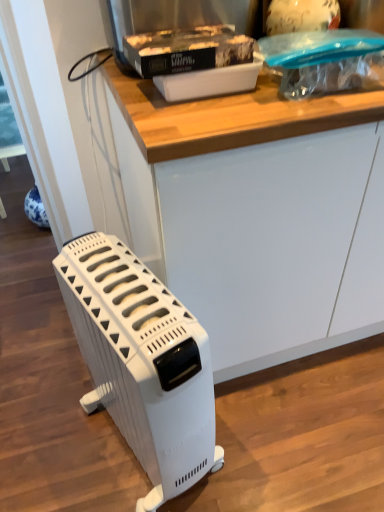
In order to click on vacant space that is to the left of white plastic heater at lower left in this screenshot , I will do `click(55, 437)`.